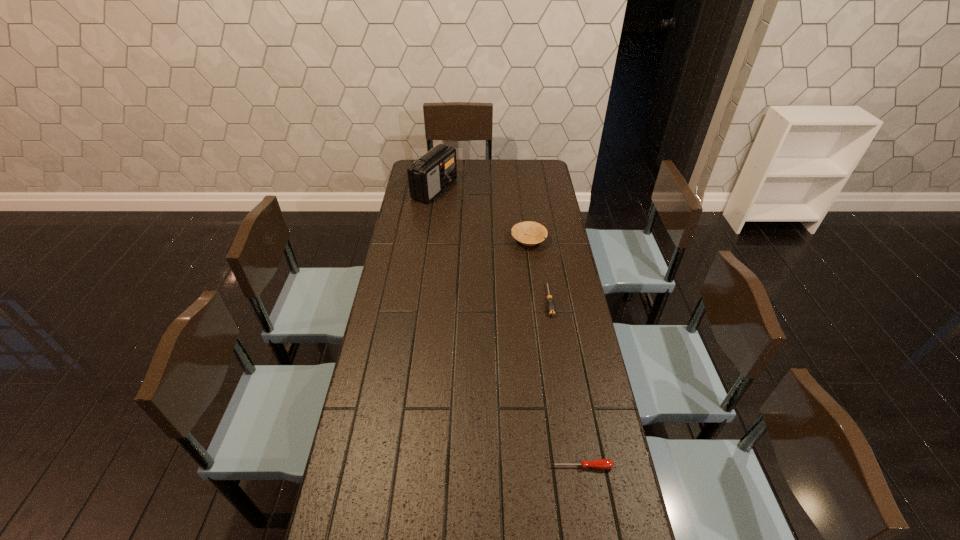
Identify the location of empty space between the farther screwdriver and the second farthest object. (539, 271).

Where is `empty space between the nearest object and the farthest object`? The width and height of the screenshot is (960, 540). empty space between the nearest object and the farthest object is located at coordinates (508, 328).

In order to click on free spot between the second nearest object and the second tallest object in this screenshot , I will do `click(539, 271)`.

Where is `vacant region between the nearer screwdriver and the farther screwdriver`? The image size is (960, 540). vacant region between the nearer screwdriver and the farther screwdriver is located at coordinates (565, 383).

Identify the location of empty location between the nearest object and the third shortest object. (555, 353).

I want to click on free space between the third farthest object and the nearer screwdriver, so click(x=565, y=383).

Where is `unoccupied area between the tallest object and the nearer screwdriver`? unoccupied area between the tallest object and the nearer screwdriver is located at coordinates (508, 328).

Find the location of a particular element. the second closest object relative to the bowl is located at coordinates (428, 176).

At what (x,y) coordinates should I click in order to perform the action: click on object that is the second closest to the bowl. Please return your answer as a coordinate pair (x, y). Looking at the image, I should click on (x=428, y=176).

The width and height of the screenshot is (960, 540). What are the coordinates of `free space that satisfies the following two spatial constraints: 1. on the back side of the farther screwdriver; 2. on the front panel of the farthest object` in the screenshot? It's located at (532, 189).